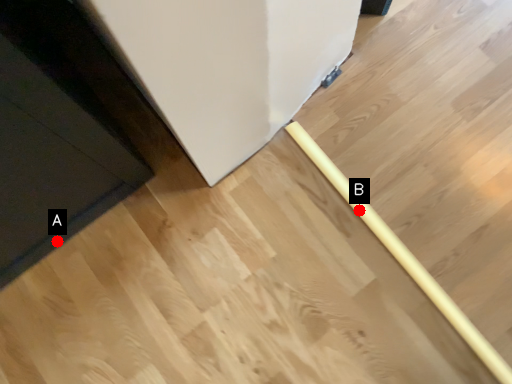
Question: Two points are circled on the image, labeled by A and B beside each circle. Which point appears farthest from the camera in this image?

Choices:
 (A) A is further
 (B) B is further

Answer: (A)